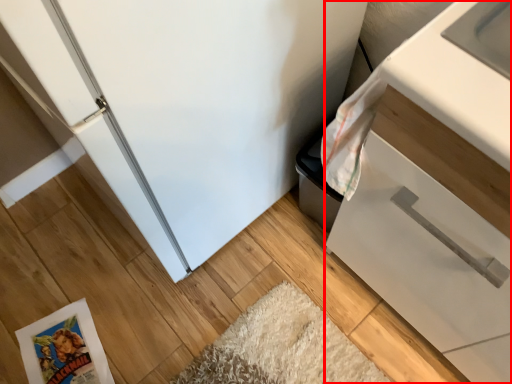
Question: From the image's perspective, what is the correct spatial relationship of cabinetry (annotated by the red box) in relation to comic book?

Choices:
 (A) above
 (B) below

Answer: (A)